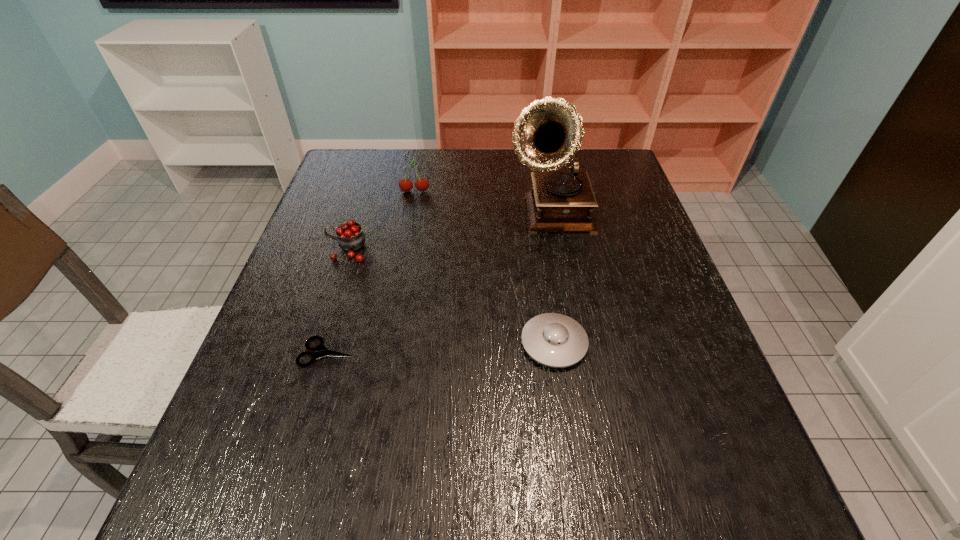
The width and height of the screenshot is (960, 540). What are the coordinates of `free space between the left cherry and the second shortest object` in the screenshot? It's located at (450, 296).

In order to click on vacant space in between the left cherry and the record player in this screenshot , I will do `click(450, 233)`.

Image resolution: width=960 pixels, height=540 pixels. In order to click on free spot between the shears and the second shortest object in this screenshot , I will do `click(442, 348)`.

Where is `empty space that is in between the record player and the saucer`? empty space that is in between the record player and the saucer is located at coordinates (553, 280).

Image resolution: width=960 pixels, height=540 pixels. I want to click on unoccupied area between the record player and the farther cherry, so (x=484, y=204).

The height and width of the screenshot is (540, 960). Identify the location of free spot between the right cherry and the record player. click(x=484, y=204).

You are a GUI agent. You are given a task and a screenshot of the screen. Output one action in this format:
    pyautogui.click(x=<x>, y=<y>)
    Task: Click on the free spot between the farther cherry and the record player
    Image resolution: width=960 pixels, height=540 pixels.
    Given the screenshot: What is the action you would take?
    pyautogui.click(x=484, y=204)

In order to click on vacant region between the record player and the saucer in this screenshot , I will do `click(553, 280)`.

Identify the location of unoccupied position between the record player and the second shortest object. The image size is (960, 540). (553, 280).

At what (x,y) coordinates should I click in order to perform the action: click on vacant area that lies between the right cherry and the shortest object. Please return your answer as a coordinate pair (x, y). Image resolution: width=960 pixels, height=540 pixels. Looking at the image, I should click on pos(372,272).